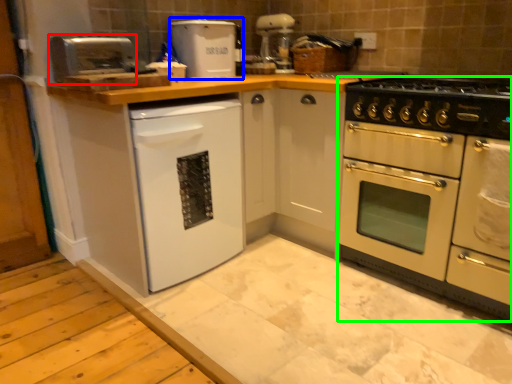
Question: Considering the real-world distances, which object is closest to appliance (highlighted by a red box)? appliance (highlighted by a blue box) or oven (highlighted by a green box).

Choices:
 (A) appliance
 (B) oven

Answer: (A)